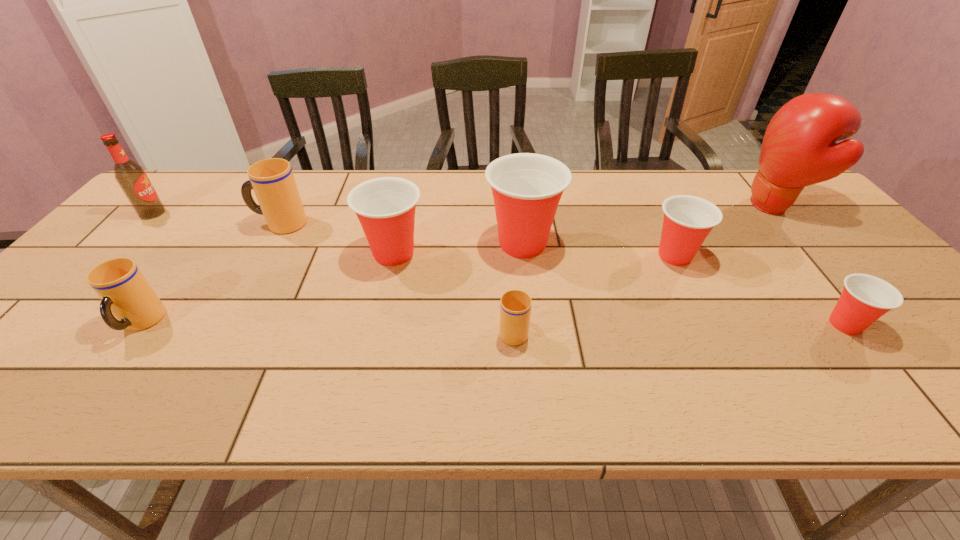
I want to click on boxing glove, so [799, 148].

Where is `red boxing glove`? Image resolution: width=960 pixels, height=540 pixels. red boxing glove is located at coordinates (799, 148).

You are a GUI agent. You are given a task and a screenshot of the screen. Output one action in this format:
    pyautogui.click(x=<x>, y=<y>)
    Task: Click on the beer bottle
    Image resolution: width=960 pixels, height=540 pixels.
    Given the screenshot: What is the action you would take?
    pyautogui.click(x=131, y=177)

You are a GUI agent. You are given a task and a screenshot of the screen. Output one action in this format:
    pyautogui.click(x=<x>, y=<y>)
    Task: Click on the tallest cup
    This screenshot has height=540, width=960.
    Given the screenshot: What is the action you would take?
    pyautogui.click(x=526, y=187)

Locate an element on the screen. The image size is (960, 540). the biggest red cup is located at coordinates (526, 187).

Where is `the sixth cup from right to left`? the sixth cup from right to left is located at coordinates (272, 180).

At what (x,y) coordinates should I click in order to perform the action: click on the second beige cup from right to left. Please return your answer as a coordinate pair (x, y). Looking at the image, I should click on (272, 180).

At what (x,y) coordinates should I click in order to perform the action: click on the fourth object from left to right. Please return your answer as a coordinate pair (x, y). The width and height of the screenshot is (960, 540). Looking at the image, I should click on (385, 206).

Find the location of a particular element. This screenshot has height=540, width=960. the fifth cup from right to left is located at coordinates click(385, 206).

Where is `the seventh object from left to right`? the seventh object from left to right is located at coordinates (688, 220).